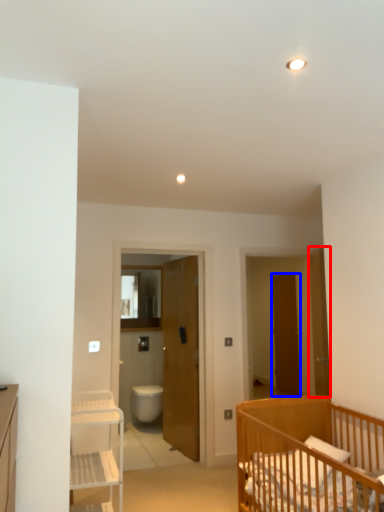
Question: Which of the following is the farthest to the observer, door (highlighted by a red box) or door (highlighted by a blue box)?

Choices:
 (A) door
 (B) door

Answer: (B)